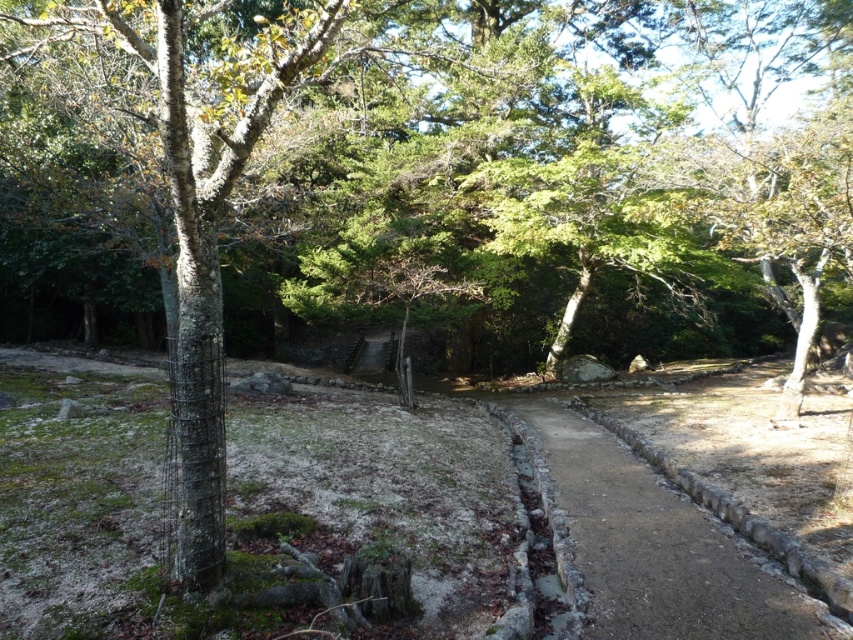
Question: Among these points, which one is nearest to the camera?

Choices:
 (A) (170, 346)
 (B) (631, 604)

Answer: (B)

Question: Can you confirm if smooth bark tree at left is smaller than dirt path at center?

Choices:
 (A) yes
 (B) no

Answer: (A)

Question: Which point is farther to the camera?

Choices:
 (A) smooth bark tree at left
 (B) dirt path at center

Answer: (B)

Question: Can you confirm if smooth bark tree at left is smaller than dirt path at center?

Choices:
 (A) yes
 (B) no

Answer: (A)

Question: Can you confirm if smooth bark tree at left is positioned to the right of dirt path at center?

Choices:
 (A) yes
 (B) no

Answer: (B)